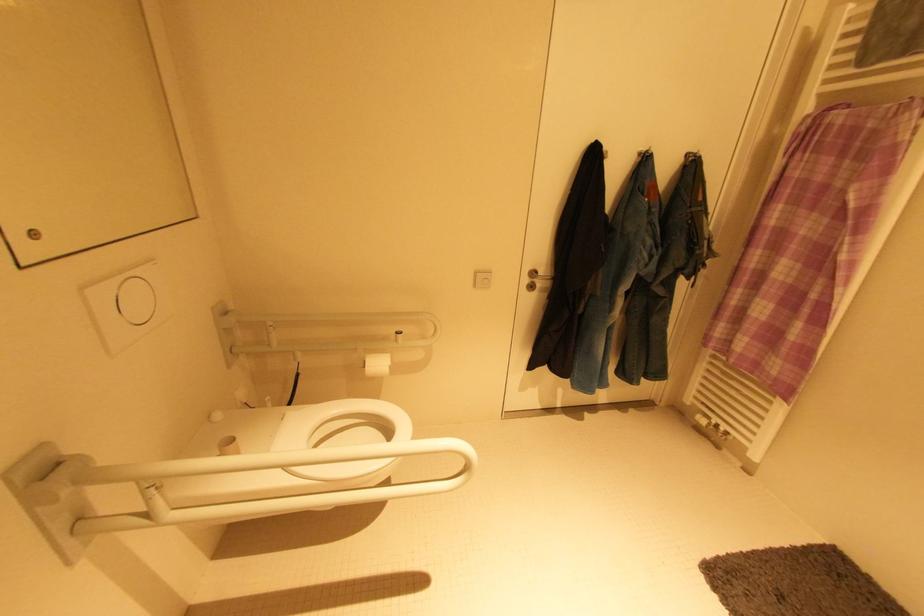
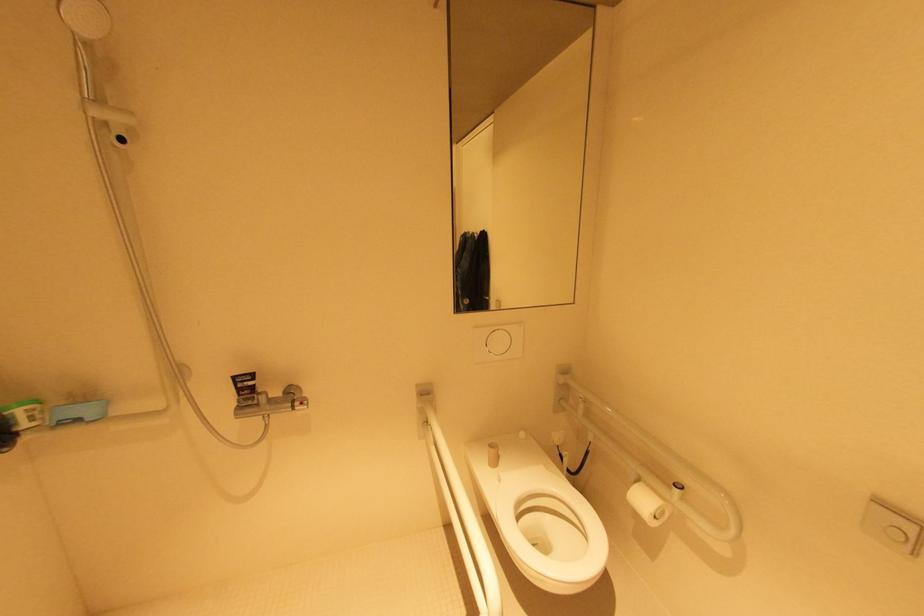
Question: The camera is either moving clockwise (left) or counter-clockwise (right) around the object. The first image is from the beginning of the video and the second image is from the end. Is the camera moving left or right when shooting the video?

Choices:
 (A) Left
 (B) Right

Answer: (B)